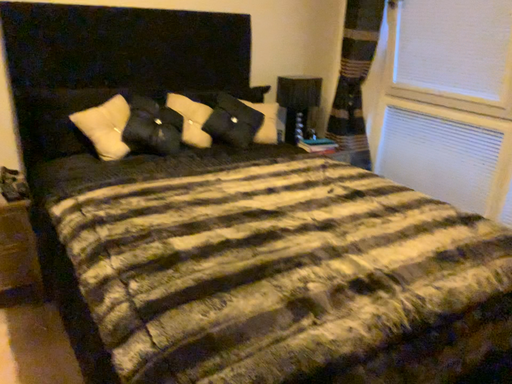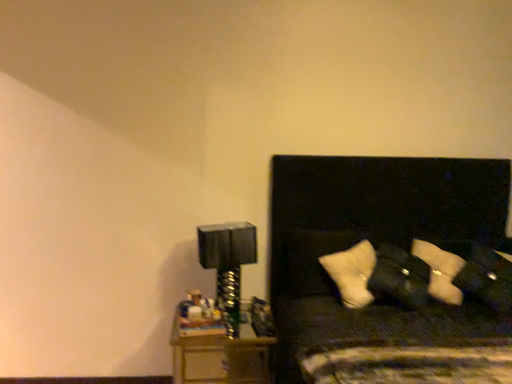
Question: How did the camera likely rotate when shooting the video?

Choices:
 (A) rotated left
 (B) rotated right

Answer: (A)